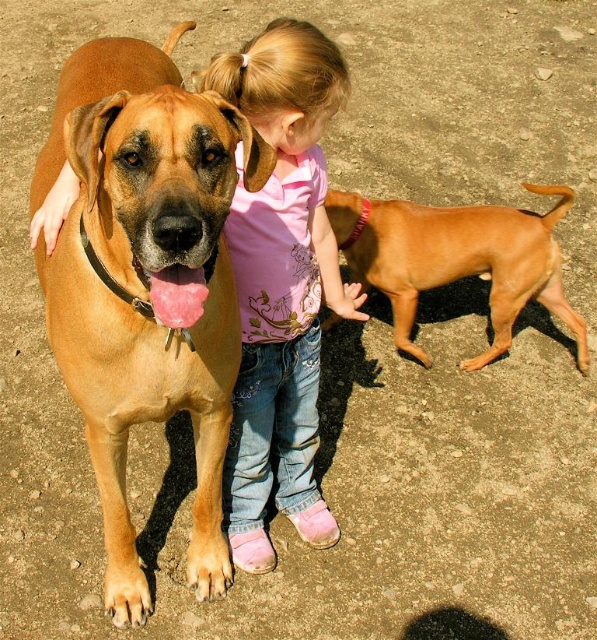
Question: Among these points, which one is farthest from the camera?

Choices:
 (A) (307, 264)
 (B) (395, 262)
 (C) (118, 397)

Answer: (B)

Question: Considering the relative positions of matte brown dog at center and pink cotton shirt at center in the image provided, where is matte brown dog at center located with respect to pink cotton shirt at center?

Choices:
 (A) right
 (B) left

Answer: (B)

Question: Which point appears closest to the camera in this image?

Choices:
 (A) (165, 161)
 (B) (496, 353)

Answer: (A)

Question: Does matte brown dog at center appear under pink cotton shirt at center?

Choices:
 (A) yes
 (B) no

Answer: (A)

Question: Considering the real-world distances, which object is farthest from the pink cotton shirt at center?

Choices:
 (A) smooth tan dog at center
 (B) matte brown dog at center

Answer: (A)

Question: Is pink cotton shirt at center smaller than smooth tan dog at center?

Choices:
 (A) yes
 (B) no

Answer: (A)